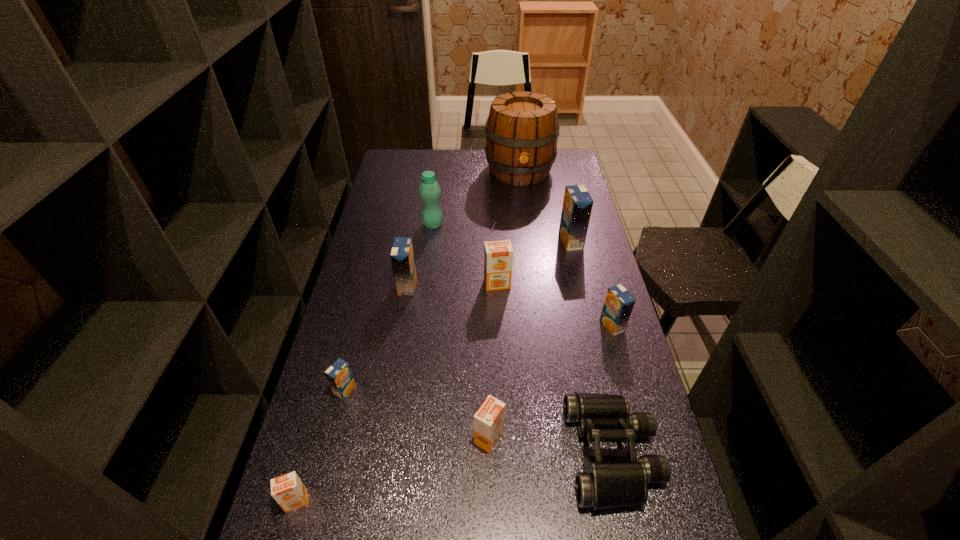
This screenshot has width=960, height=540. Identify the location of cider that is at the right edge. (522, 129).

The height and width of the screenshot is (540, 960). What are the coordinates of `binoculars present at the right edge` in the screenshot? It's located at (608, 481).

Where is `object at the far right corner`? The image size is (960, 540). object at the far right corner is located at coordinates (522, 129).

Locate an element on the screen. The width and height of the screenshot is (960, 540). free spot at the far edge of the desktop is located at coordinates (469, 172).

I want to click on free location at the left edge, so click(337, 338).

In the image, there is a desktop. Find the location of `free space at the right edge`. free space at the right edge is located at coordinates (628, 510).

Where is `free space at the far left corner`? The width and height of the screenshot is (960, 540). free space at the far left corner is located at coordinates (398, 171).

Locate an element on the screen. The height and width of the screenshot is (540, 960). vacant area that lies between the sixth farthest orange juice and the farthest object is located at coordinates (504, 305).

This screenshot has height=540, width=960. What are the coordinates of `free space between the nearest blue orange_juice and the third biggest blue orange_juice` in the screenshot? It's located at (479, 358).

Find the location of a particular element. The height and width of the screenshot is (540, 960). free space between the farthest object and the biggest orange orange juice is located at coordinates (509, 228).